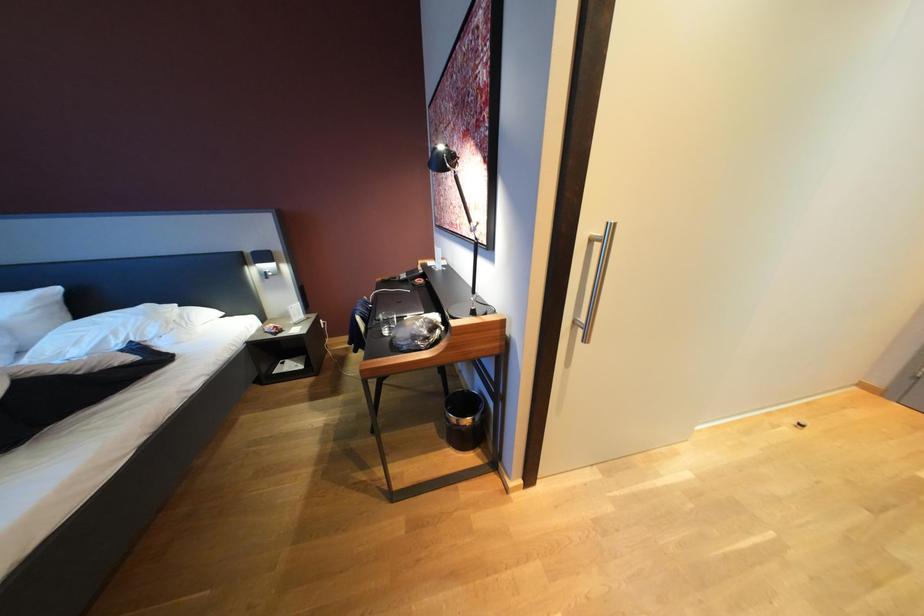
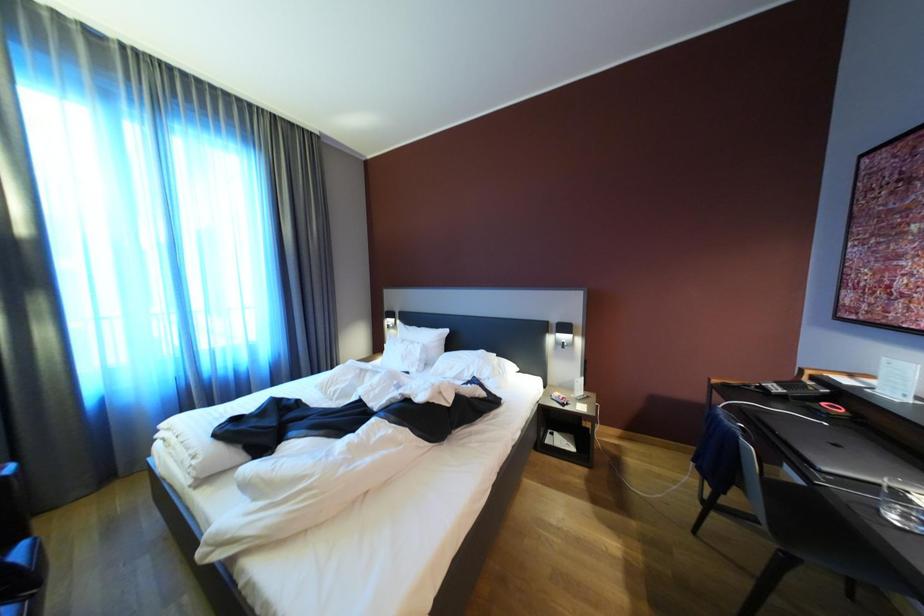
Question: The images are taken continuously from a first-person perspective. In which direction is your viewpoint rotating?

Choices:
 (A) Left
 (B) Right
 (C) Up
 (D) Down

Answer: (A)